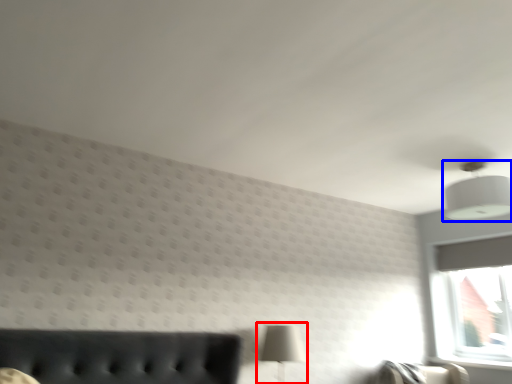
Question: Which point is closer to the camera, table lamp (highlighted by a red box) or lamp (highlighted by a blue box)?

Choices:
 (A) table lamp
 (B) lamp

Answer: (B)